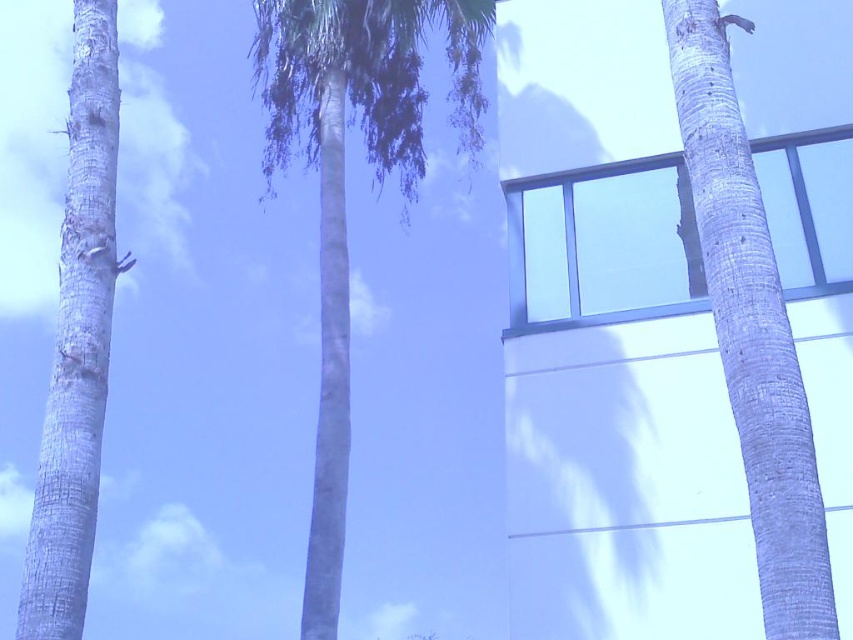
Question: Is smooth gray bark at right further to the viewer compared to smooth gray bark at left?

Choices:
 (A) no
 (B) yes

Answer: (A)

Question: Which of the following is the closest to the observer?

Choices:
 (A) (770, 252)
 (B) (67, 532)

Answer: (A)

Question: Does smooth gray palm tree at center have a greater width compared to smooth gray bark at left?

Choices:
 (A) no
 (B) yes

Answer: (A)

Question: Estimate the real-world distances between objects in this image. Which object is closer to the smooth gray palm tree at center?

Choices:
 (A) smooth gray bark at right
 (B) smooth gray bark at left

Answer: (B)

Question: Does smooth gray palm tree at center have a lesser width compared to smooth gray bark at right?

Choices:
 (A) no
 (B) yes

Answer: (B)

Question: Which point is farther from the camera taking this photo?

Choices:
 (A) (314, 19)
 (B) (103, 67)

Answer: (A)